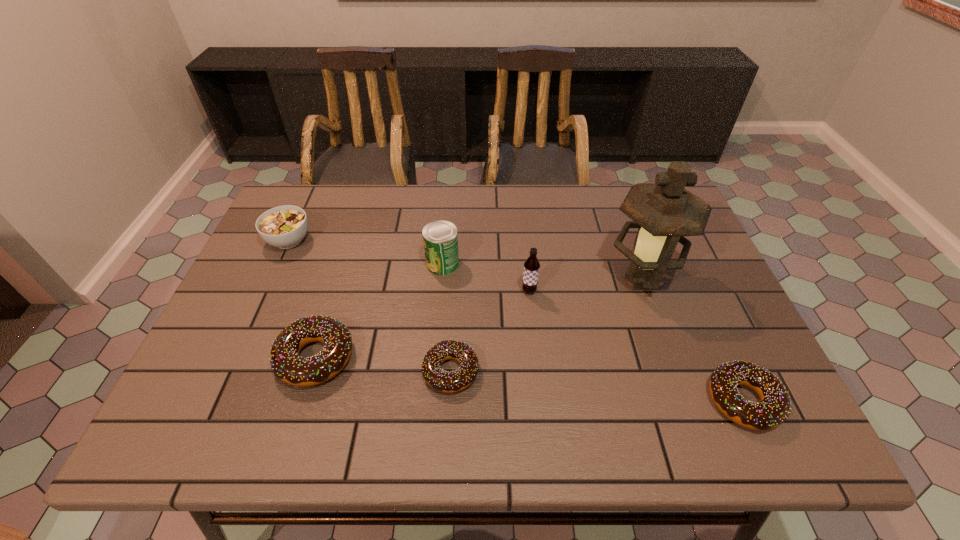
You are a GUI agent. You are given a task and a screenshot of the screen. Output one action in this format:
    pyautogui.click(x=<x>, y=<y>)
    Task: Click on the doughnut that is positioned at the right edge
    
    Given the screenshot: What is the action you would take?
    pyautogui.click(x=774, y=408)

Where is `oil lamp that is at the right edge`? This screenshot has width=960, height=540. oil lamp that is at the right edge is located at coordinates (664, 212).

At what (x,y) coordinates should I click in order to perform the action: click on object situated at the far left corner. Please return your answer as a coordinate pair (x, y). Looking at the image, I should click on (285, 226).

Where is `object at the near right corner`? This screenshot has height=540, width=960. object at the near right corner is located at coordinates (774, 408).

In order to click on vacant region at the far edge of the desktop in this screenshot , I will do `click(486, 211)`.

The image size is (960, 540). What are the coordinates of `vacant space at the near edge of the desktop` in the screenshot? It's located at click(x=612, y=385).

In the image, there is a desktop. What are the coordinates of `free space at the left edge` in the screenshot? It's located at (297, 298).

In the image, there is a desktop. Where is `vacant space at the far left corner`? The image size is (960, 540). vacant space at the far left corner is located at coordinates (338, 184).

In the image, there is a desktop. Find the location of `blank space at the near left corner`. blank space at the near left corner is located at coordinates [x=219, y=399].

Find the location of a particular element. This screenshot has width=960, height=540. empty space that is in between the oil lamp and the can is located at coordinates (541, 271).